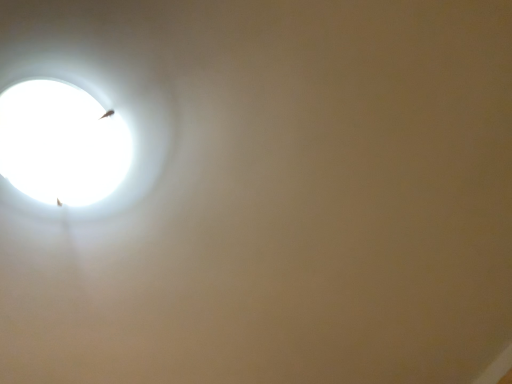
Describe the element at coordinates (61, 143) in the screenshot. This screenshot has width=512, height=384. I see `white glossy lamp at upper left` at that location.

Image resolution: width=512 pixels, height=384 pixels. In order to click on white glossy lamp at upper left in this screenshot , I will do `click(61, 143)`.

The image size is (512, 384). In order to click on white glossy lamp at upper left in this screenshot , I will do `click(61, 143)`.